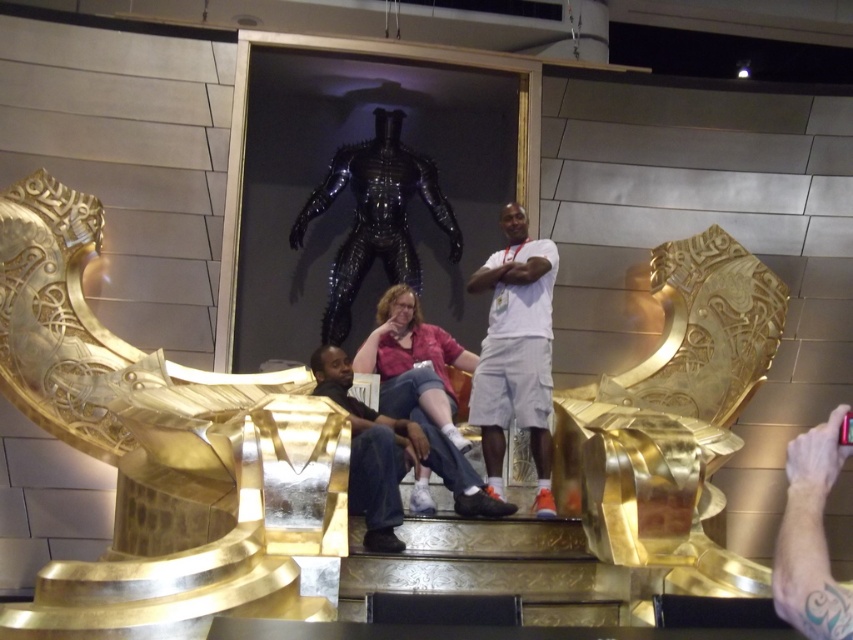
Does gold polished metal throne at center appear on the right side of white matte shorts at center?

In fact, gold polished metal throne at center is to the left of white matte shorts at center.

Is point (316, 461) less distant than point (506, 401)?

Yes, point (316, 461) is closer to viewer.

Who is more forward, (x=141, y=572) or (x=503, y=259)?

Positioned in front is point (x=141, y=572).

You are a GUI agent. You are given a task and a screenshot of the screen. Output one action in this format:
    pyautogui.click(x=<x>, y=<y>)
    Task: Click on the gold polished metal throne at center
    
    Given the screenshot: What is the action you would take?
    pyautogui.click(x=160, y=452)

Measure the distance between point (148, 621) and camera.

A distance of 24.41 meters exists between point (148, 621) and camera.

What do you see at coordinates (160, 452) in the screenshot? The image size is (853, 640). I see `gold polished metal throne at center` at bounding box center [160, 452].

Does point (154, 524) lie behind point (440, 339)?

No.

At what (x,y) coordinates should I click in order to perform the action: click on gold polished metal throne at center. Please return your answer as a coordinate pair (x, y). Looking at the image, I should click on (160, 452).

Can you confirm if white matte shorts at center is bigger than matte black pants at center?

Yes.

Find the location of `white matte shorts at center`. white matte shorts at center is located at coordinates (515, 353).

Find the location of a particular element. white matte shorts at center is located at coordinates (515, 353).